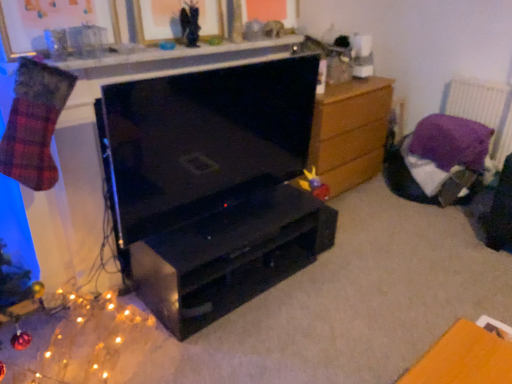
Question: Is purple fabric at upper right positioned with its back to matte black angel at upper center, which is the 1th toy in top-to-bottom order?

Choices:
 (A) yes
 (B) no

Answer: (B)

Question: From a real-world perspective, is purple fabric at upper right below matte black angel at upper center, acting as the second toy starting from the back?

Choices:
 (A) yes
 (B) no

Answer: (A)

Question: From a real-world perspective, is purple fabric at upper right over matte black angel at upper center, positioned as the 2th toy in right-to-left order?

Choices:
 (A) no
 (B) yes

Answer: (A)

Question: Could you tell me if purple fabric at upper right is turned towards matte black angel at upper center, positioned as the 2th toy in bottom-to-top order?

Choices:
 (A) yes
 (B) no

Answer: (A)

Question: Can you see purple fabric at upper right touching matte black angel at upper center, positioned as the 2th toy in bottom-to-top order?

Choices:
 (A) no
 (B) yes

Answer: (A)

Question: Is purple fabric at upper right located outside matte black angel at upper center, which is the 1th toy in top-to-bottom order?

Choices:
 (A) yes
 (B) no

Answer: (A)

Question: Considering the relative sizes of purple fabric at upper right and glittering gold lights at lower left in the image provided, is purple fabric at upper right shorter than glittering gold lights at lower left?

Choices:
 (A) yes
 (B) no

Answer: (B)

Question: Considering the relative sizes of purple fabric at upper right and glittering gold lights at lower left in the image provided, is purple fabric at upper right taller than glittering gold lights at lower left?

Choices:
 (A) yes
 (B) no

Answer: (A)

Question: Is glittering gold lights at lower left at the back of purple fabric at upper right?

Choices:
 (A) yes
 (B) no

Answer: (B)

Question: Is glittering gold lights at lower left a part of purple fabric at upper right?

Choices:
 (A) yes
 (B) no

Answer: (B)

Question: Considering the relative sizes of purple fabric at upper right and glittering gold lights at lower left in the image provided, is purple fabric at upper right thinner than glittering gold lights at lower left?

Choices:
 (A) no
 (B) yes

Answer: (B)

Question: Is the position of purple fabric at upper right more distant than that of glittering gold lights at lower left?

Choices:
 (A) no
 (B) yes

Answer: (B)

Question: Is metallic gold picture frame at upper center, the second picture frame positioned from the left, closer to the viewer compared to wooden chest of drawers at right?

Choices:
 (A) yes
 (B) no

Answer: (A)